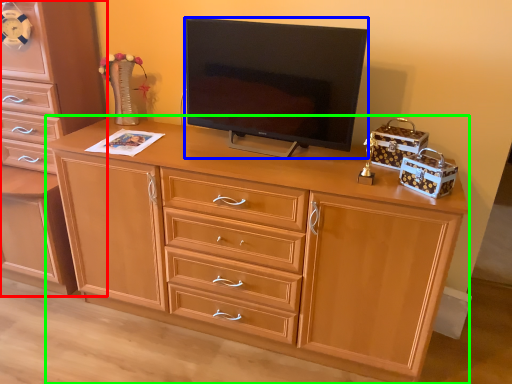
Question: Which is farther away from chest of drawers (highlighted by a red box)? television (highlighted by a blue box) or desk (highlighted by a green box)?

Choices:
 (A) television
 (B) desk

Answer: (A)